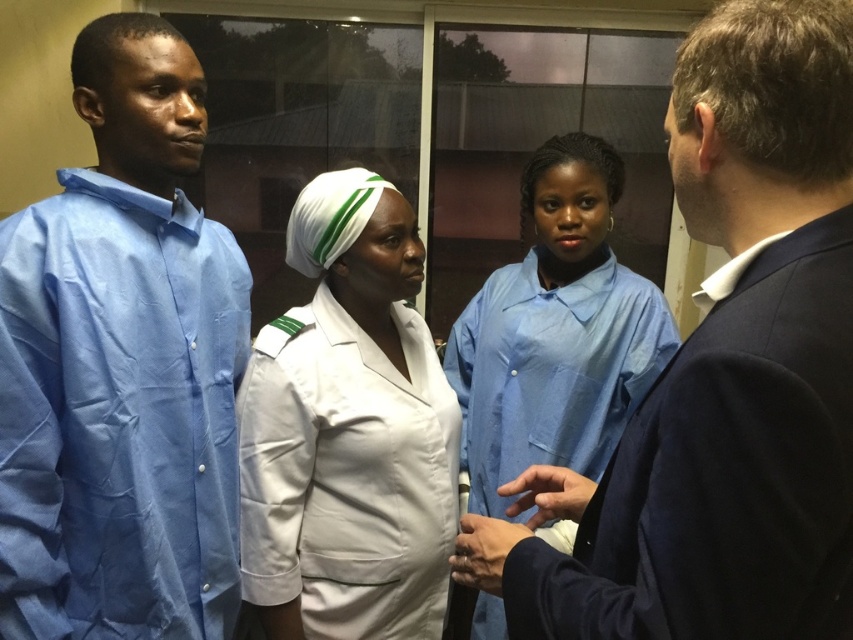
Who is positioned more to the right, light blue fabric shirt at left or blue smooth uniform at center?

From the viewer's perspective, blue smooth uniform at center appears more on the right side.

Does point (103, 484) come behind point (572, 458)?

No, it is in front of (572, 458).

The height and width of the screenshot is (640, 853). In order to click on light blue fabric shirt at left in this screenshot , I will do `click(122, 365)`.

Is point (4, 273) positioned behind point (627, 548)?

Yes, point (4, 273) is farther from viewer.

Does light blue fabric shirt at left have a greater width compared to blue cotton uniform at right?

No, light blue fabric shirt at left is not wider than blue cotton uniform at right.

The width and height of the screenshot is (853, 640). I want to click on light blue fabric shirt at left, so click(x=122, y=365).

Is point (325, 172) more distant than point (605, 344)?

No.

The height and width of the screenshot is (640, 853). Identify the location of white smooth uniform at center. (347, 432).